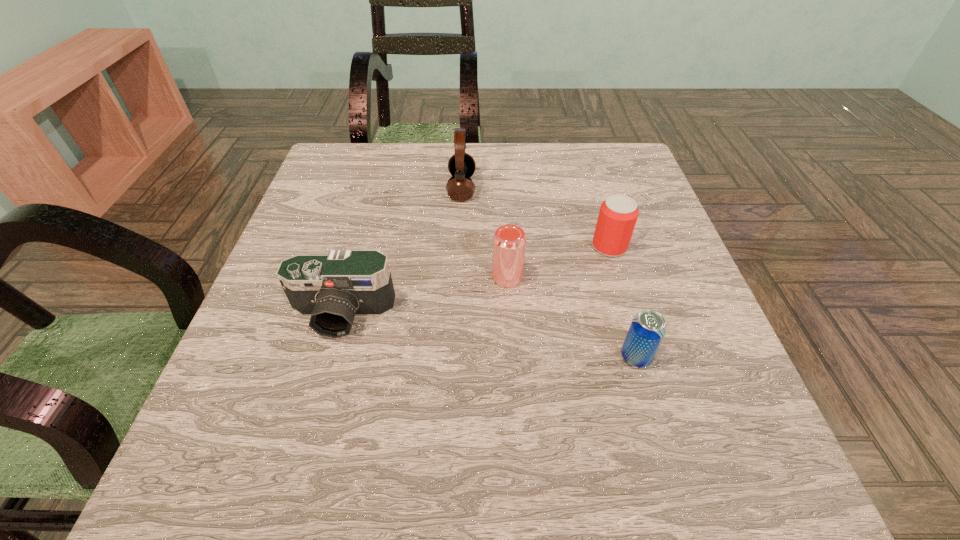
This screenshot has height=540, width=960. Find the location of `free space located on the front of the third object from right to left`. free space located on the front of the third object from right to left is located at coordinates (516, 414).

This screenshot has height=540, width=960. Identify the location of blank area located 0.130m on the front-facing side of the second nearest object. (316, 410).

This screenshot has width=960, height=540. In order to click on free space located 0.280m on the back of the nearest beer can in this screenshot , I will do `click(601, 238)`.

This screenshot has width=960, height=540. Identify the location of object present at the far edge. (461, 165).

Find the location of `object present at the left edge`. object present at the left edge is located at coordinates (332, 289).

Image resolution: width=960 pixels, height=540 pixels. Find the location of `free region at the far edge of the desktop`. free region at the far edge of the desktop is located at coordinates (500, 163).

Find the location of `vacant space at the near edge`. vacant space at the near edge is located at coordinates [x=651, y=450].

The width and height of the screenshot is (960, 540). What are the coordinates of `vacant area at the left edge of the desktop` in the screenshot? It's located at coord(348,218).

In the image, there is a desktop. Identify the location of free region at the right edge. The image size is (960, 540). (692, 313).

The image size is (960, 540). In the image, there is a desktop. Identify the location of vacant space at the far left corner. (373, 147).